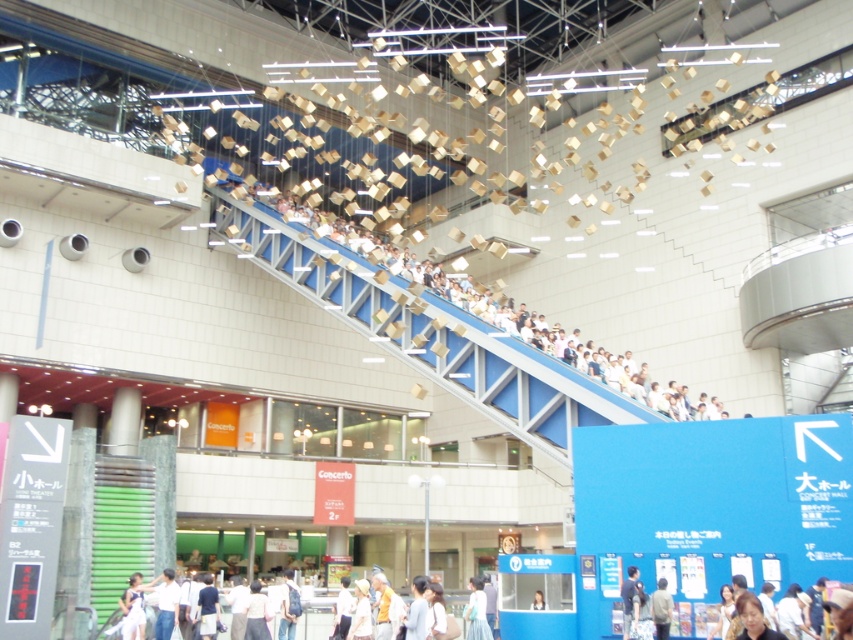
Question: Is light blue fabric at lower center to the left of light blue shirt at upper center from the viewer's perspective?

Choices:
 (A) yes
 (B) no

Answer: (A)

Question: Which of the following is the closest to the observer?

Choices:
 (A) light blue shirt at upper center
 (B) light blue shirt at lower center
 (C) light blue fabric at lower center
 (D) light brown hair at upper center

Answer: (B)

Question: Is light blue shirt at lower center bigger than light brown hair at upper center?

Choices:
 (A) no
 (B) yes

Answer: (B)

Question: Which point appears closest to the camera in this image?

Choices:
 (A) (747, 627)
 (B) (538, 596)

Answer: (A)

Question: Which object is farther from the camera taking this photo?

Choices:
 (A) light blue fabric at lower center
 (B) light blue shirt at upper center
 (C) matte black hair at lower right
 (D) light brown fabric shirt at lower right

Answer: (A)

Question: Is light blue shirt at lower center thinner than light blue shirt at upper center?

Choices:
 (A) yes
 (B) no

Answer: (B)